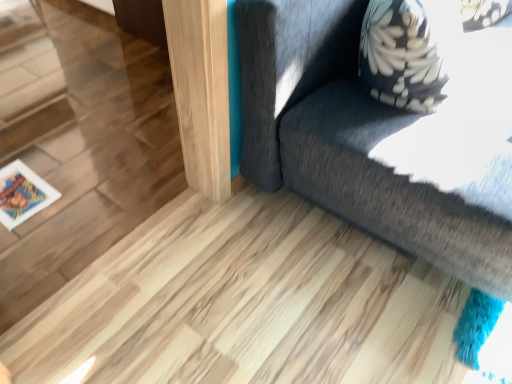
Locate an element on the screen. free space above wooden frame at lower left (from a real-world perspective) is located at coordinates (23, 191).